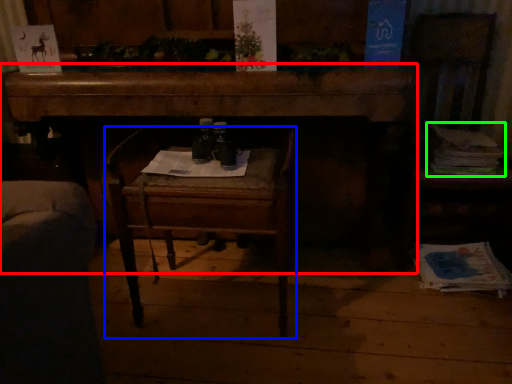
Question: Which object is the farthest from desk (highlighted by a red box)? Choose among these: chair (highlighted by a blue box) or magazine (highlighted by a green box).

Choices:
 (A) chair
 (B) magazine

Answer: (B)